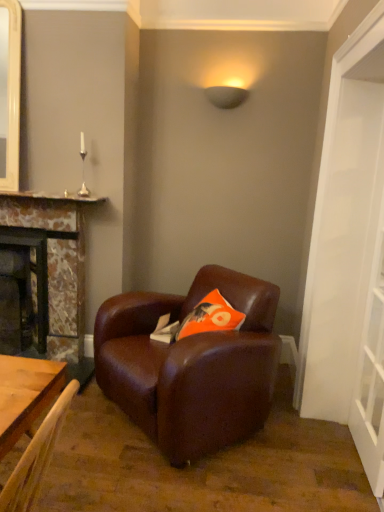
Question: From the image's perspective, is transparent glass door at right on matte black lampshade at upper center?

Choices:
 (A) yes
 (B) no

Answer: (B)

Question: Is transparent glass door at right oriented towards matte black lampshade at upper center?

Choices:
 (A) no
 (B) yes

Answer: (A)

Question: Does transparent glass door at right appear on the left side of matte black lampshade at upper center?

Choices:
 (A) yes
 (B) no

Answer: (B)

Question: From a real-world perspective, is transparent glass door at right on matte black lampshade at upper center?

Choices:
 (A) yes
 (B) no

Answer: (B)

Question: From the image's perspective, is transparent glass door at right located beneath matte black lampshade at upper center?

Choices:
 (A) no
 (B) yes

Answer: (B)

Question: Does point [x=52, y=263] appear closer or farther from the camera than point [x=266, y=409]?

Choices:
 (A) closer
 (B) farther

Answer: (B)

Question: From a real-world perspective, relative to brown leather armchair at center, is marble fireplace at left, the 2th fireplace in the left-to-right sequence, vertically above or below?

Choices:
 (A) below
 (B) above

Answer: (B)

Question: Is marble fireplace at left, which is the 1th fireplace from right to left, wider or thinner than brown leather armchair at center?

Choices:
 (A) wide
 (B) thin

Answer: (B)

Question: Is marble fireplace at left, which is the 1th fireplace from right to left, taller or shorter than brown leather armchair at center?

Choices:
 (A) tall
 (B) short

Answer: (A)

Question: From a real-world perspective, is matte stone fireplace at left, acting as the 2th fireplace starting from the right, physically located above or below transparent glass door at right?

Choices:
 (A) above
 (B) below

Answer: (B)

Question: Choose the correct answer: Is matte stone fireplace at left, acting as the 2th fireplace starting from the right, inside transparent glass door at right or outside it?

Choices:
 (A) inside
 (B) outside

Answer: (B)

Question: Is matte stone fireplace at left, which appears as the first fireplace when viewed from the left, taller or shorter than transparent glass door at right?

Choices:
 (A) short
 (B) tall

Answer: (A)

Question: Is matte stone fireplace at left, which appears as the first fireplace when viewed from the left, in front of or behind transparent glass door at right in the image?

Choices:
 (A) front
 (B) behind

Answer: (B)

Question: In terms of size, does orange fabric pillow at center appear bigger or smaller than matte stone fireplace at left, acting as the 2th fireplace starting from the right?

Choices:
 (A) small
 (B) big

Answer: (A)

Question: Considering the positions of orange fabric pillow at center and matte stone fireplace at left, which appears as the first fireplace when viewed from the left, in the image, is orange fabric pillow at center wider or thinner than matte stone fireplace at left, which appears as the first fireplace when viewed from the left,?

Choices:
 (A) wide
 (B) thin

Answer: (A)